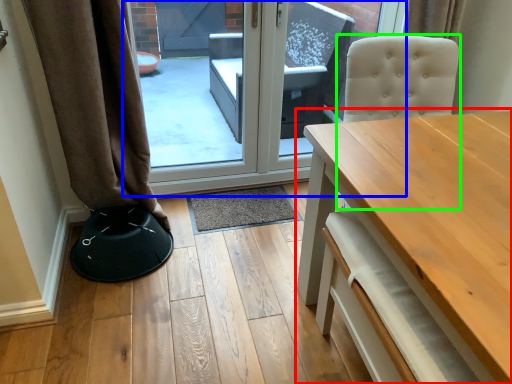
Question: Based on their relative distances, which object is nearer to table (highlighted by a red box)? Choose from door (highlighted by a blue box) and swivel chair (highlighted by a green box).

Choices:
 (A) door
 (B) swivel chair

Answer: (B)